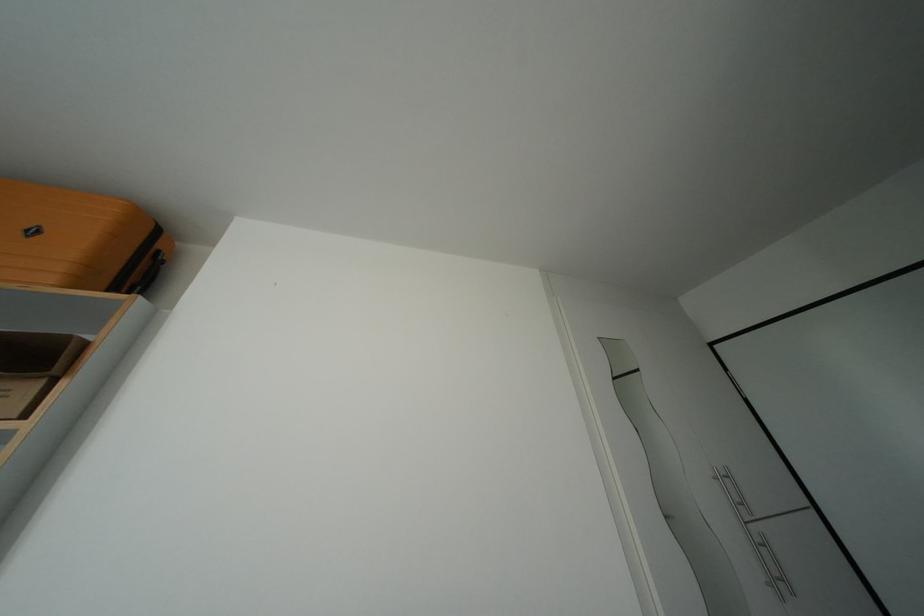
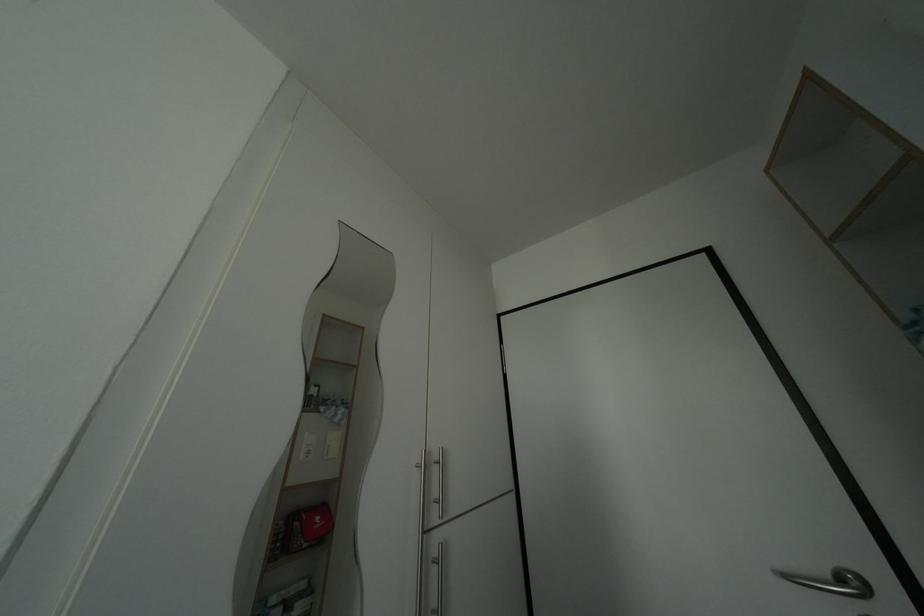
Question: The first image is from the beginning of the video and the second image is from the end. How did the camera likely rotate when shooting the video?

Choices:
 (A) Left
 (B) Right
 (C) Up
 (D) Down

Answer: (B)